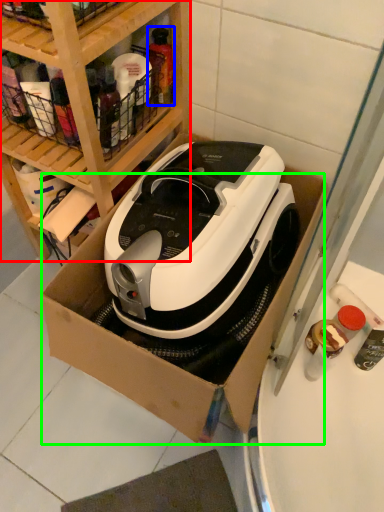
Question: Which object is positioned closest to shelf (highlighted by a red box)? Select from bottle (highlighted by a blue box) and cardboard box (highlighted by a green box).

Choices:
 (A) bottle
 (B) cardboard box

Answer: (A)